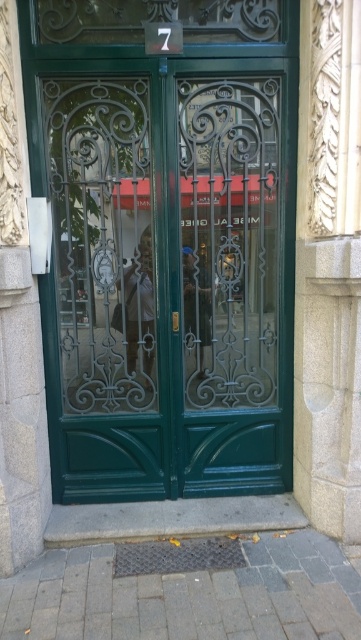
You are trying to decide which item to wear for a casual day out. The scene shows a matte white shirt at center and a smooth leather jacket at center. Which clothing item is wider?

The matte white shirt at center is wider than the smooth leather jacket at center according to the description.

You are standing in front of the double doors and want to enter. You notice the green glass screen door at center and the matte white shirt at center. Which object is taller and can you see through the taller one?

The green glass screen door at center is taller than the matte white shirt at center, and yes, you can see through the green glass screen door at center because it is made of glass.